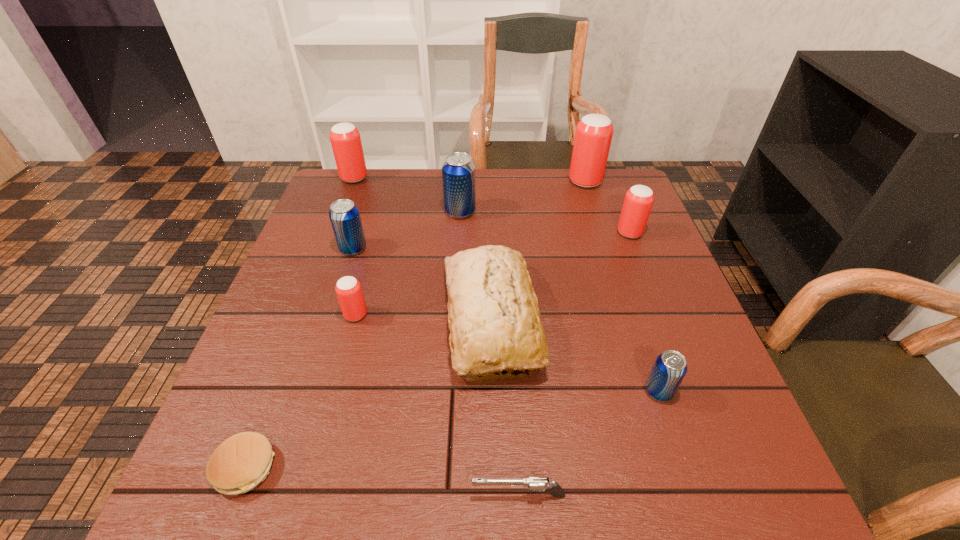
This screenshot has width=960, height=540. I want to click on the tallest object, so click(x=593, y=136).

Where is `the tallest beer can`? This screenshot has width=960, height=540. the tallest beer can is located at coordinates (593, 136).

Where is `the leftmost red beer can`? the leftmost red beer can is located at coordinates (345, 139).

This screenshot has width=960, height=540. Find the location of `the fifth nearest beer can`. the fifth nearest beer can is located at coordinates (458, 170).

Locate an element on the screen. the fourth beer can from right to left is located at coordinates (458, 170).

At what (x,y) coordinates should I click in order to perform the action: click on the second smallest red beer can. Please return your answer as a coordinate pair (x, y). This screenshot has width=960, height=540. Looking at the image, I should click on (639, 199).

Where is `the second farthest blue beer can`? the second farthest blue beer can is located at coordinates (344, 215).

Locate an element on the screen. the leftmost blue beer can is located at coordinates (344, 215).

Image resolution: width=960 pixels, height=540 pixels. Find the location of `bread`. bread is located at coordinates (494, 320).

You are a GUI agent. You are given a task and a screenshot of the screen. Output one action in this format:
    pyautogui.click(x=<x>, y=<y>)
    Task: Click on the nearest blue beer can
    Image resolution: width=960 pixels, height=540 pixels.
    Given the screenshot: What is the action you would take?
    pyautogui.click(x=670, y=367)